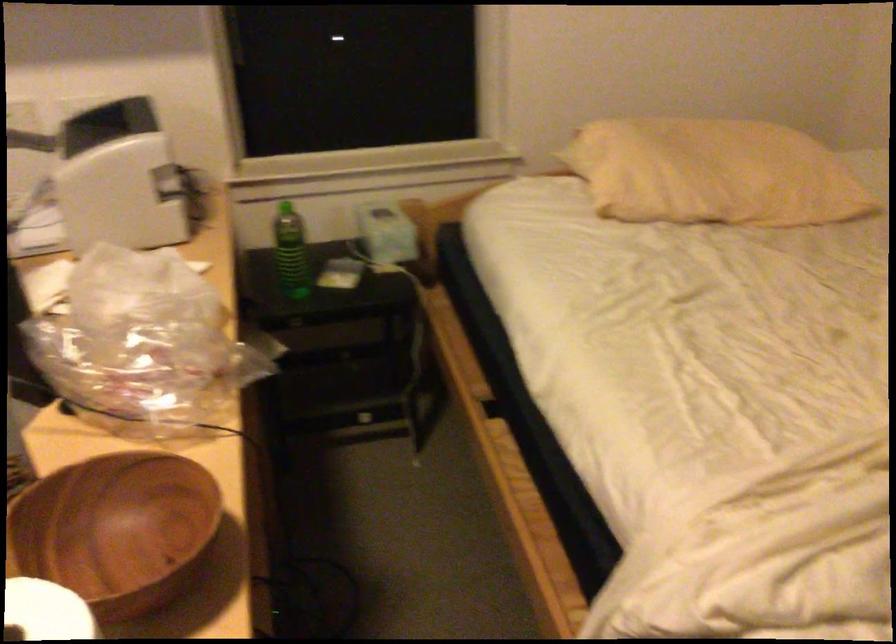
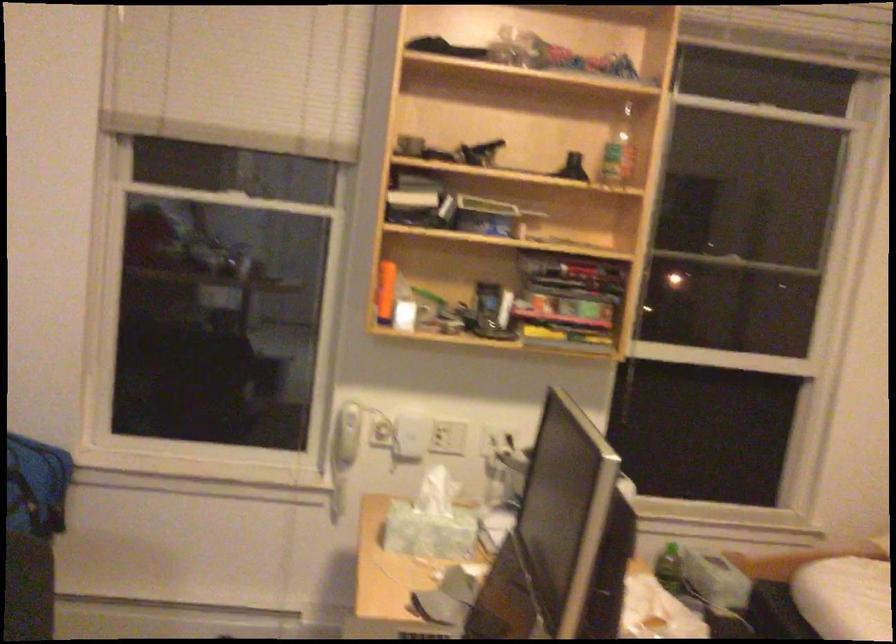
Find the pixel in the second image that matches [487,231] in the first image.

(845, 598)